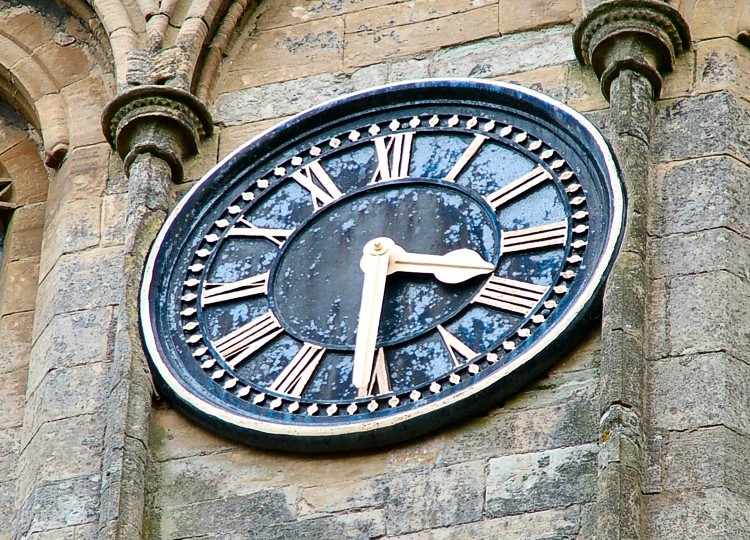
I want to click on white long brick area above clock, so click(531, 48), click(258, 98).